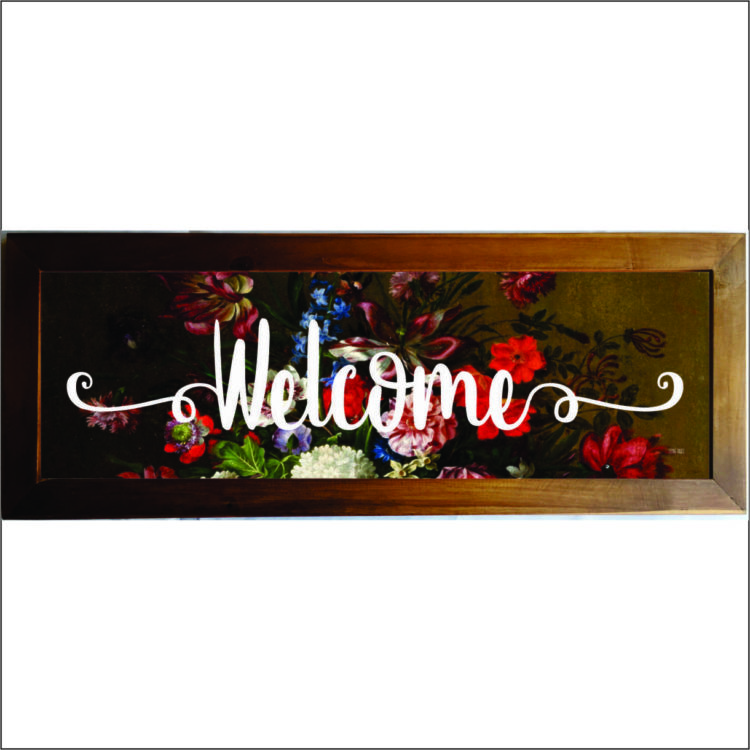
This screenshot has width=750, height=750. What are the coordinates of `upper right corner miter cut of frame` in the screenshot? It's located at (728, 253).